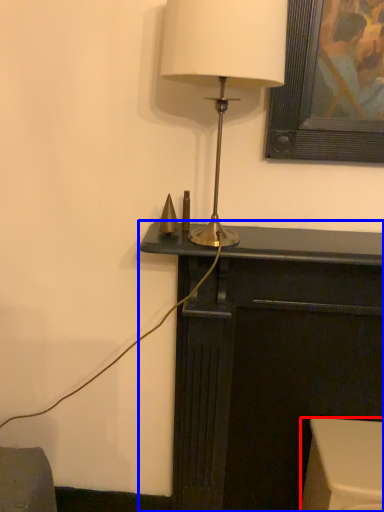
Question: Which object appears closest to the camera in this image, furniture (highlighted by a red box) or furniture (highlighted by a blue box)?

Choices:
 (A) furniture
 (B) furniture

Answer: (B)